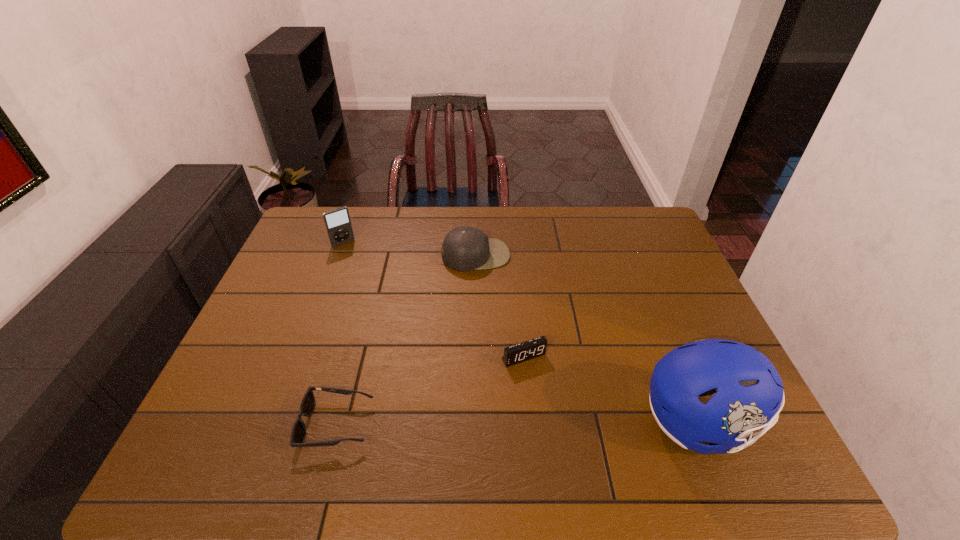
Locate an element on the screen. This screenshot has height=540, width=960. free space between the alarm clock and the tallest object is located at coordinates pos(612,390).

The image size is (960, 540). I want to click on vacant space that's between the alarm clock and the cap, so click(x=500, y=306).

Image resolution: width=960 pixels, height=540 pixels. Identify the location of vacant region between the cap and the shortest object. (406, 340).

Find the location of a particular element. Image resolution: width=960 pixels, height=540 pixels. object that stands as the third closest to the sunglasses is located at coordinates (338, 224).

This screenshot has height=540, width=960. In order to click on the third closest object to the third nearest object in this screenshot , I will do 307,405.

Identify the location of free space that satisfies the following two spatial constraints: 1. on the front side of the fourth tallest object; 2. on the right side of the iPod. (300, 357).

Where is `vacant space that satisfies the following two spatial constraints: 1. on the front side of the iPod; 2. on the front-facing side of the shortest object`? vacant space that satisfies the following two spatial constraints: 1. on the front side of the iPod; 2. on the front-facing side of the shortest object is located at coordinates (276, 424).